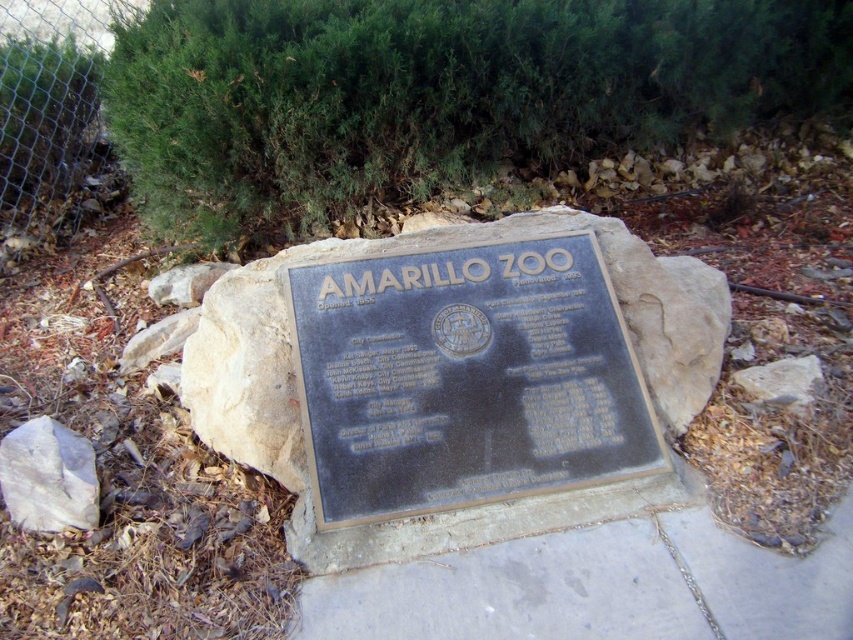
Can you confirm if bronze plaque at center is positioned to the right of metal mesh fence at upper left?

Correct, you'll find bronze plaque at center to the right of metal mesh fence at upper left.

Who is positioned more to the right, bronze plaque at center or metal mesh fence at upper left?

bronze plaque at center

I want to click on bronze plaque at center, so click(x=465, y=378).

Is green leafy bush at upper center positioned behind metal mesh fence at upper left?

That is False.

Based on the photo, is green leafy bush at upper center thinner than metal mesh fence at upper left?

Incorrect, green leafy bush at upper center's width is not less than metal mesh fence at upper left's.

Between point (257, 19) and point (39, 0), which one is positioned behind?

Point (39, 0)

Find the location of a particular element. green leafy bush at upper center is located at coordinates (434, 92).

Measure the distance between green leafy bush at upper center and white rough rock at lower left.

green leafy bush at upper center and white rough rock at lower left are 3.69 feet apart.

Is green leafy bush at upper center above white rough rock at lower left?

Yes, green leafy bush at upper center is above white rough rock at lower left.

Which is behind, point (434, 22) or point (47, 520)?

The point (434, 22) is behind.

Identify the location of green leafy bush at upper center. The image size is (853, 640). (434, 92).